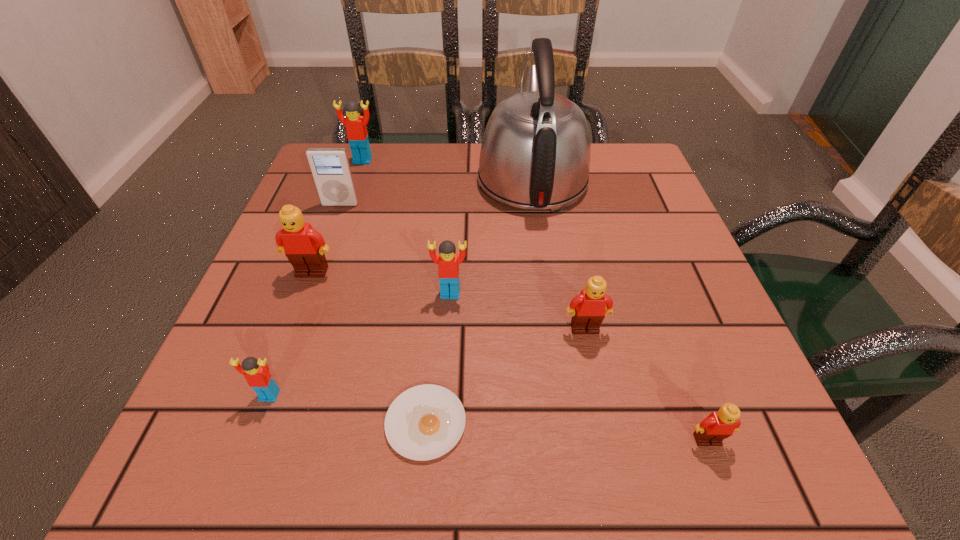
Identify the location of empty space that is in between the biggest brown Lego and the tallest object. click(422, 225).

Where is `free point between the rightmost Lego and the fifth farthest object`? The height and width of the screenshot is (540, 960). free point between the rightmost Lego and the fifth farthest object is located at coordinates (579, 367).

Where is `unoccupied position between the egg yolk and the biggest red Lego`? unoccupied position between the egg yolk and the biggest red Lego is located at coordinates (395, 292).

You are a GUI agent. You are given a task and a screenshot of the screen. Output one action in this format:
    pyautogui.click(x=<x>, y=<y>)
    Task: Click on the free spot between the kettle and the shortest object
    
    Given the screenshot: What is the action you would take?
    pyautogui.click(x=479, y=300)

I want to click on blank region between the iPod and the smallest red Lego, so click(x=305, y=300).

This screenshot has height=540, width=960. Find the location of `free space between the egg yolk and the tallest object`. free space between the egg yolk and the tallest object is located at coordinates (479, 300).

Where is `vacant space that's between the biggest red Lego and the leftmost brown Lego`? vacant space that's between the biggest red Lego and the leftmost brown Lego is located at coordinates (337, 217).

Where is `vacant area that lies between the nearest brown Lego and the nearest red Lego`? vacant area that lies between the nearest brown Lego and the nearest red Lego is located at coordinates [489, 418].

Locate an element on the screen. object that stands as the second closest to the kettle is located at coordinates (357, 135).

The height and width of the screenshot is (540, 960). In order to click on object that stands as the second closest to the second biggest brown Lego in this screenshot , I will do `click(719, 425)`.